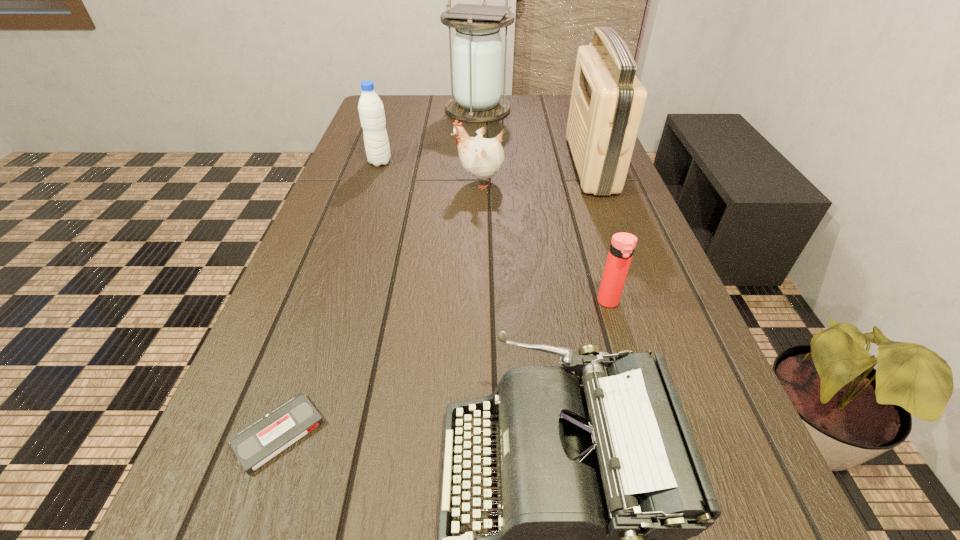
You are a GUI agent. You are given a task and a screenshot of the screen. Output one action in this format:
    pyautogui.click(x=<x>, y=<y>)
    Task: Click on the thermos bottle that is at the right edge
    
    Given the screenshot: What is the action you would take?
    pyautogui.click(x=622, y=246)

Where is `vacant space at the far edge of the desktop`? The image size is (960, 540). vacant space at the far edge of the desktop is located at coordinates (420, 95).

Locate an element on the screen. free space at the left edge is located at coordinates (272, 389).

In the image, there is a desktop. Identify the location of free region at the right edge. Image resolution: width=960 pixels, height=540 pixels. (602, 208).

Find the location of a particular element. free spot between the shortest object and the bird is located at coordinates (379, 307).

You are a GUI agent. You are given a task and a screenshot of the screen. Output one action in this format:
    pyautogui.click(x=<x>, y=<y>)
    Task: Click on the free area in between the fifth shortest object and the videotape
    
    Given the screenshot: What is the action you would take?
    pyautogui.click(x=329, y=298)

Where is `free area in between the lantern and the thermos bottle`? The width and height of the screenshot is (960, 540). free area in between the lantern and the thermos bottle is located at coordinates click(x=543, y=206).

Where is `vacant area between the water bottle and the fifth farthest object`? This screenshot has height=540, width=960. vacant area between the water bottle and the fifth farthest object is located at coordinates (494, 232).

Where is `unoccupied area between the radio receiver and the lantern`? unoccupied area between the radio receiver and the lantern is located at coordinates (535, 137).

Locate which object ranks third in proximity to the typewriter. Please provide its 2D coordinates. Your answer should be formatted as a tuple, i.e. [(x, y)], where the tuple contains the x and y coordinates of a point satisfying the conditions above.

[(481, 157)]